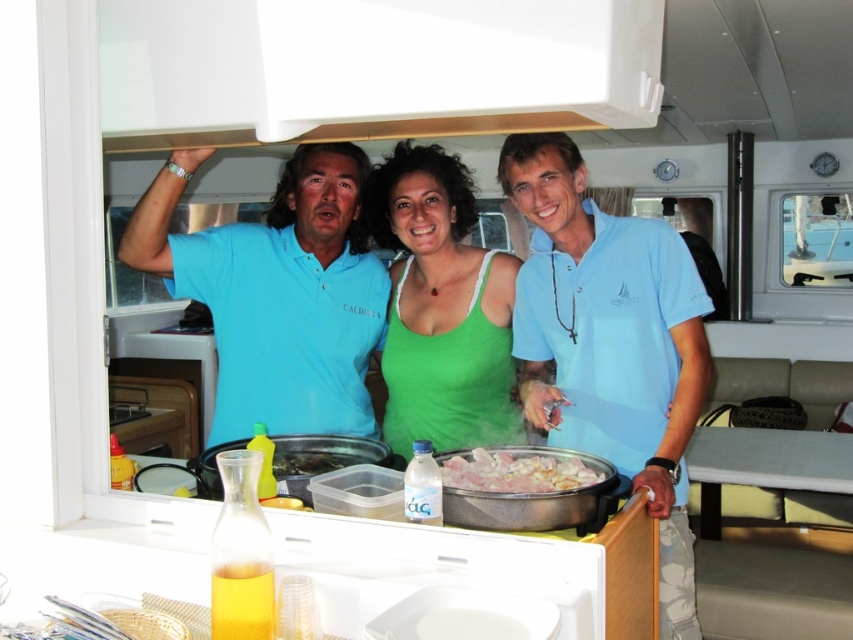
Question: Which point is farther to the camera?

Choices:
 (A) blue cotton shirt at upper left
 (B) light blue polo shirt at center

Answer: (A)

Question: Is blue cotton shirt at upper left to the right of green fabric tank top at center from the viewer's perspective?

Choices:
 (A) no
 (B) yes

Answer: (A)

Question: Can you confirm if light blue polo shirt at center is positioned below green fabric tank top at center?

Choices:
 (A) yes
 (B) no

Answer: (A)

Question: Can you confirm if light blue polo shirt at center is thinner than blue cotton shirt at upper left?

Choices:
 (A) no
 (B) yes

Answer: (B)

Question: Among these objects, which one is nearest to the camera?

Choices:
 (A) blue cotton shirt at upper left
 (B) green fabric tank top at center
 (C) light blue polo shirt at center
 (D) white glossy meat at center

Answer: (D)

Question: Among these points, which one is nearest to the camera?

Choices:
 (A) (461, 460)
 (B) (660, 488)
 (C) (364, 221)

Answer: (A)